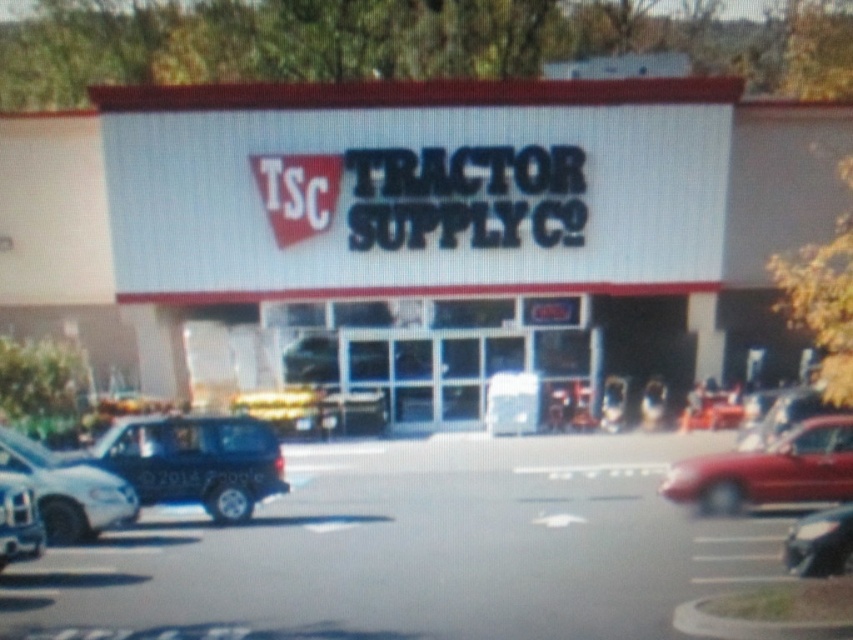
You are standing in the parking lot of the Tractor Supply Company store and want to take a photo of the store entrance. Which object, the white matte building at center or the shiny black sedan at lower right, should you position yourself closer to in order to capture the entrance clearly in your photo?

To capture the store entrance clearly, you should position yourself closer to the white matte building at center because it is much taller than the shiny black sedan at lower right, making it more prominent in the frame.

You are standing in the parking lot of the Tractor Supply Company store. You see the white matte building at center and the shiny black sedan at lower right. Which object is positioned to the left when facing the store?

The white matte building at center is positioned to the left of the shiny black sedan at lower right when facing the store.

You are a delivery driver arriving at the Tractor Supply Company store. You need to park your truck, which is as large as the white matte building at center. Can your truck fit in the parking spot where the shiny black sedan at lower right is currently parked?

The white matte building at center is larger in size than the shiny black sedan at lower right. Since your truck is as large as the building, it would not fit in the parking spot meant for the smaller sedan.